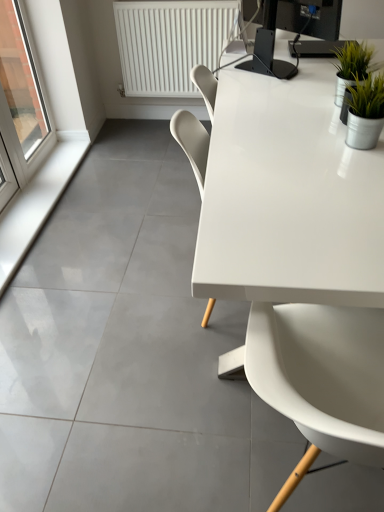
Image resolution: width=384 pixels, height=512 pixels. Identify the location of white smooth window sill at lower left. (36, 205).

The image size is (384, 512). What do you see at coordinates (171, 42) in the screenshot?
I see `white plastic radiator at upper center` at bounding box center [171, 42].

What is the approximate width of white glossy chair at center?

It is 62.04 centimeters.

This screenshot has width=384, height=512. What do you see at coordinates (19, 106) in the screenshot?
I see `transparent glass window at left` at bounding box center [19, 106].

What is the approximate height of white glossy table at upper right?

The height of white glossy table at upper right is 29.93 inches.

The height and width of the screenshot is (512, 384). What do you see at coordinates (303, 17) in the screenshot?
I see `black glossy monitor at upper right` at bounding box center [303, 17].

Image resolution: width=384 pixels, height=512 pixels. In order to click on green metallic pot at upper right in this screenshot , I will do `click(352, 66)`.

In order to face green metallic pot at upper right, should I rotate leftwards or rightwards?

Turn right by 20.534 degrees to look at green metallic pot at upper right.

Identify the location of white smooth window sill at lower left. (36, 205).

From a real-world perspective, is transparent glass window at left on white glossy table at upper right?

Yes, from a real-world perspective, transparent glass window at left is on top of white glossy table at upper right.

Is transparent glass window at left facing away from white glossy table at upper right?

That's not correct — transparent glass window at left is not looking away from white glossy table at upper right.

Which object is more forward, transparent glass window at left or white glossy table at upper right?

Positioned in front is white glossy table at upper right.

Does point (29, 203) appear closer or farther from the camera than point (310, 19)?

Clearly, point (29, 203) is more distant from the camera than point (310, 19).

How distant is white smooth window sill at lower left from black glossy monitor at upper right?

white smooth window sill at lower left and black glossy monitor at upper right are 1.41 meters apart.

From a real-world perspective, relative to black glossy monitor at upper right, is white smooth window sill at lower left vertically above or below?

white smooth window sill at lower left is situated lower than black glossy monitor at upper right in the real world.

Locate an element on the screen. The height and width of the screenshot is (512, 384). houseplant below the black glossy monitor at upper right (from the image's perspective) is located at coordinates (352, 66).

From the image's perspective, is black glossy monitor at upper right over green metallic pot at upper right?

Yes.

Does black glossy monitor at upper right come in front of green metallic pot at upper right?

No, it is not.

Would you say black glossy monitor at upper right is inside or outside green metallic pot at upper right?

The correct answer is: outside.

Considering the relative sizes of white smooth window sill at lower left and white glossy chair at center in the image provided, is white smooth window sill at lower left shorter than white glossy chair at center?

Correct, white smooth window sill at lower left is not as tall as white glossy chair at center.

Considering the positions of points (54, 147) and (351, 399), is point (54, 147) closer to camera compared to point (351, 399)?

That is False.

Which object is positioned more to the right, white smooth window sill at lower left or white glossy chair at center?

From the viewer's perspective, white glossy chair at center appears more on the right side.

From a real-world perspective, is white smooth window sill at lower left under white glossy chair at center?

Correct, in the physical world, white smooth window sill at lower left is lower than white glossy chair at center.

From a real-world perspective, which is physically below, white glossy table at upper right or green metallic pot at upper right?

From a 3D spatial view, white glossy table at upper right is below.

Is white glossy table at upper right taller than green metallic pot at upper right?

Yes, white glossy table at upper right is taller than green metallic pot at upper right.

Is white glossy table at upper right next to green metallic pot at upper right and touching it?

white glossy table at upper right is not next to green metallic pot at upper right, and they're not touching.

Based on their positions, is transparent glass window at left located to the left or right of black glossy monitor at upper right?

From the image, it's evident that transparent glass window at left is to the left of black glossy monitor at upper right.

Looking at this image, from a real-world perspective, is transparent glass window at left below black glossy monitor at upper right?

Yes.

Is the surface of transparent glass window at left in direct contact with black glossy monitor at upper right?

No, transparent glass window at left is not next to black glossy monitor at upper right.

How different are the orientations of transparent glass window at left and black glossy monitor at upper right in degrees?

The angular difference between transparent glass window at left and black glossy monitor at upper right is 44 degrees.

Which is less distant, [366,346] or [273,39]?

Point [366,346] is closer to the camera than point [273,39].

The width and height of the screenshot is (384, 512). What are the coordinates of `chair on the right of black glossy monitor at upper right` in the screenshot? It's located at (322, 374).

Does white glossy chair at center have a greater height compared to black glossy monitor at upper right?

Correct, white glossy chair at center is much taller as black glossy monitor at upper right.

Identify the location of window above the white glossy table at upper right (from the image's perspective). Image resolution: width=384 pixels, height=512 pixels. (19, 106).

Find the location of a particular element. desktop computer above the white smooth window sill at lower left (from a real-world perspective) is located at coordinates (303, 17).

Estimate the real-world distances between objects in this image. Which object is further from green metallic pot at upper right, white glossy table at upper right or white glossy chair at center?

white glossy chair at center.

From the image, which object appears to be farther from transparent glass window at left, green metallic pot at upper right or white smooth window sill at lower left?

Among the two, green metallic pot at upper right is located further to transparent glass window at left.

From the image, which object appears to be farther from white glossy chair at center, white smooth window sill at lower left or transparent glass window at left?

transparent glass window at left is further to white glossy chair at center.

When comparing their distances from white plastic radiator at upper center, does white smooth window sill at lower left or white glossy chair at center seem further?

Based on the image, white glossy chair at center appears to be further to white plastic radiator at upper center.

Which object lies nearer to the anchor point white plastic radiator at upper center, white glossy chair at center or transparent glass window at left?

Based on the image, transparent glass window at left appears to be nearer to white plastic radiator at upper center.

Considering their positions, is white glossy chair at center positioned further to green metallic pot at upper right than black glossy monitor at upper right?

white glossy chair at center is positioned further to the anchor green metallic pot at upper right.

Estimate the real-world distances between objects in this image. Which object is closer to black glossy monitor at upper right, white smooth window sill at lower left or white glossy table at upper right?

white glossy table at upper right.

From the image, which object appears to be nearer to transparent glass window at left, white smooth window sill at lower left or black glossy monitor at upper right?

white smooth window sill at lower left.

Where is `window sill between transparent glass window at left and green metallic pot at upper right`? This screenshot has width=384, height=512. window sill between transparent glass window at left and green metallic pot at upper right is located at coordinates (36, 205).

You are a GUI agent. You are given a task and a screenshot of the screen. Output one action in this format:
    pyautogui.click(x=<x>, y=<y>)
    Task: Click on the desktop computer located between white glossy chair at center and white plastic radiator at upper center in the depth direction
    
    Given the screenshot: What is the action you would take?
    pyautogui.click(x=303, y=17)

Where is `houseplant between white glossy chair at center and white plastic radiator at upper center from front to back`? houseplant between white glossy chair at center and white plastic radiator at upper center from front to back is located at coordinates (352, 66).

Locate an element on the screen. This screenshot has height=512, width=384. window sill located between white glossy table at upper right and white plastic radiator at upper center in the depth direction is located at coordinates (36, 205).